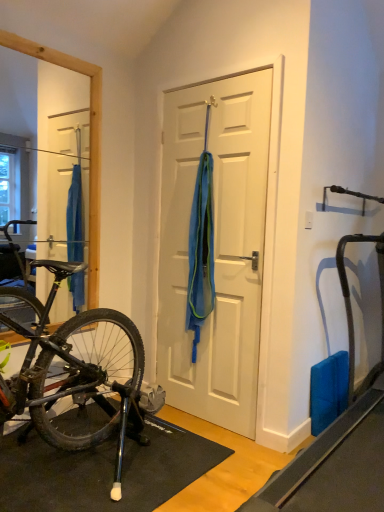
Question: Would you say white matte door at center is to the left or to the right of blue rubber mat at right in the picture?

Choices:
 (A) left
 (B) right

Answer: (A)

Question: In terms of size, does white matte door at center appear bigger or smaller than blue rubber mat at right?

Choices:
 (A) big
 (B) small

Answer: (B)

Question: Which object is the farthest from the blue rubber mat at right?

Choices:
 (A) white matte door at center
 (B) blue mesh towel at center

Answer: (B)

Question: Based on their relative distances, which object is nearer to the blue rubber mat at right?

Choices:
 (A) white matte door at center
 (B) blue mesh towel at center

Answer: (A)